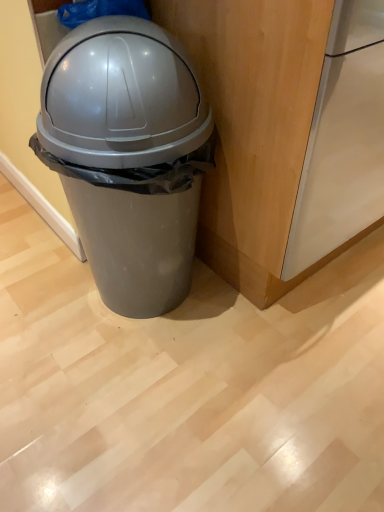
Locate an element on the screen. free space underneath matte gray plastic trash can at center (from a real-world perspective) is located at coordinates (140, 316).